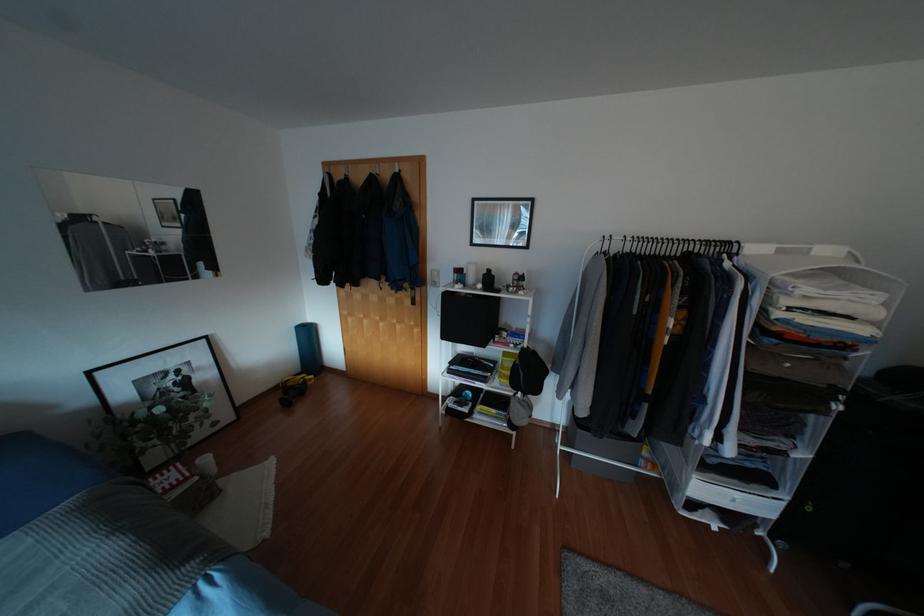
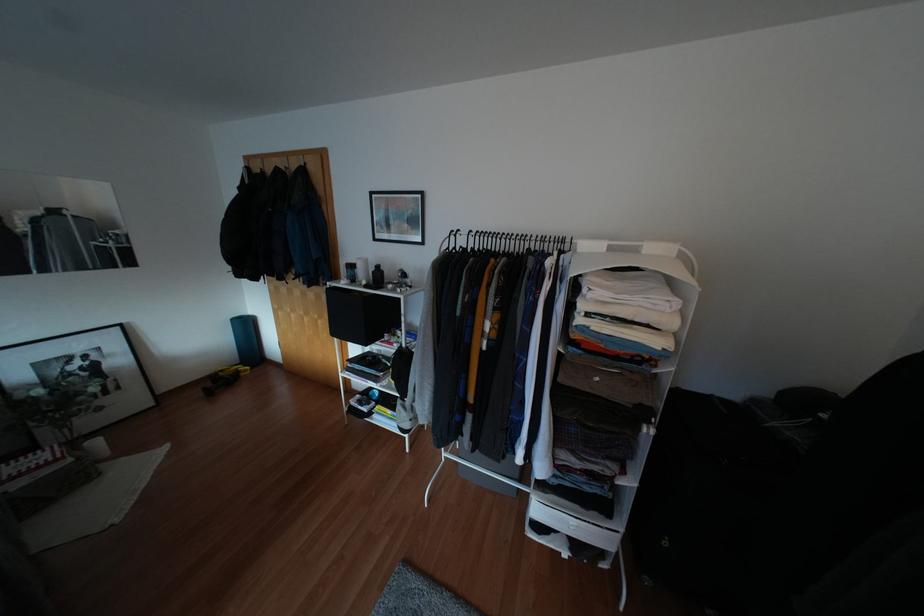
Locate, in the second image, the point that corresponds to (x=205, y=459) in the first image.

(94, 442)